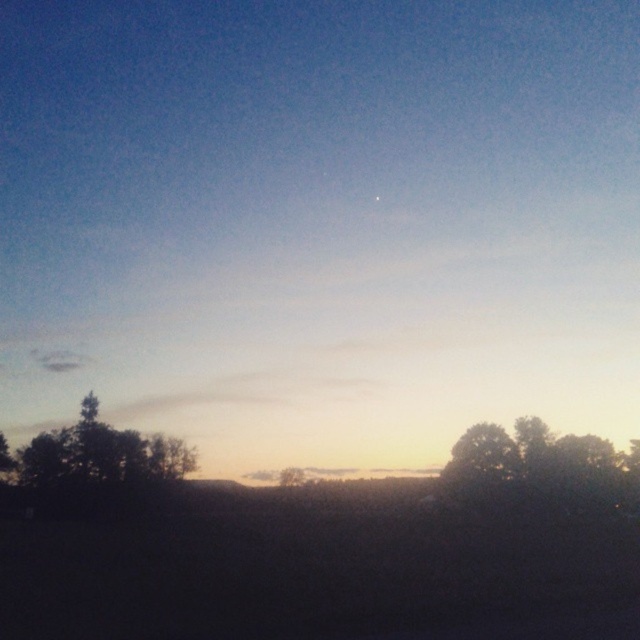
Between point (465, 492) and point (81, 436), which one is positioned behind?

Point (465, 492)

How distant is green leafy tree at lower right from green matte tree at left?

The distance of green leafy tree at lower right from green matte tree at left is 34.58 meters.

Does point (513, 490) come behind point (97, 480)?

That is True.

In order to click on green leafy tree at lower right in this screenshot , I will do pos(541,468).

Between green matte tree at left and green matte tree at center, which one has less height?

Standing shorter between the two is green matte tree at left.

Can you confirm if green matte tree at left is thinner than green matte tree at center?

Incorrect, green matte tree at left's width is not less than green matte tree at center's.

Which is behind, point (115, 490) or point (282, 483)?

The point (282, 483) is more distant.

Where is `green matte tree at left`? The image size is (640, 640). green matte tree at left is located at coordinates pyautogui.click(x=92, y=467).

Between green leafy tree at lower right and green matte tree at center, which one is positioned lower?

Positioned lower is green matte tree at center.

Is green leafy tree at lower right shorter than green matte tree at center?

Correct, green leafy tree at lower right is not as tall as green matte tree at center.

Who is more distant from viewer, (579, 506) or (291, 481)?

The point (291, 481) is more distant.

You are a GUI agent. You are given a task and a screenshot of the screen. Output one action in this format:
    pyautogui.click(x=<x>, y=<y>)
    Task: Click on the green leafy tree at lower right
    The height and width of the screenshot is (640, 640).
    Given the screenshot: What is the action you would take?
    pyautogui.click(x=541, y=468)